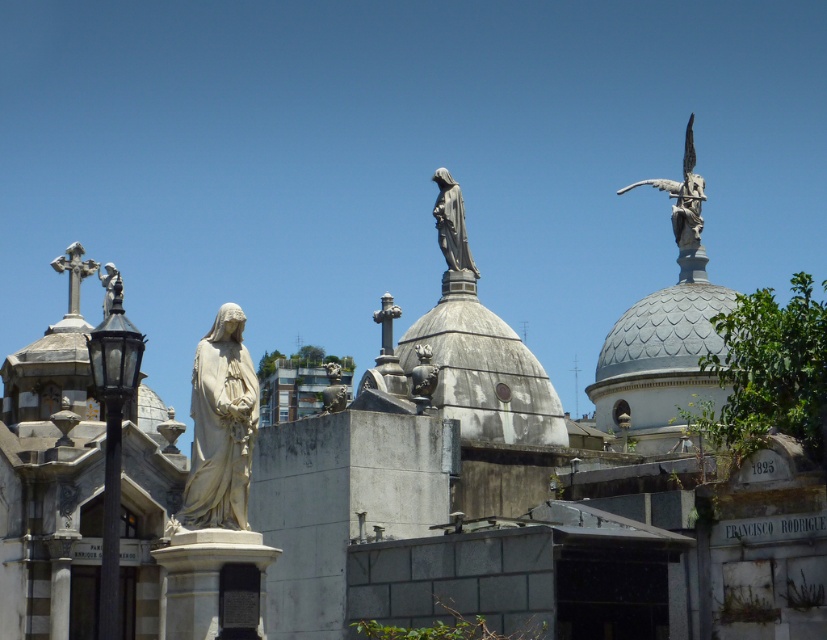
Does polished bronze angel at upper right have a lesser height compared to polished stone cross at upper left?

Incorrect, polished bronze angel at upper right's height does not fall short of polished stone cross at upper left's.

From the picture: Can you confirm if polished bronze angel at upper right is positioned below polished stone cross at upper left?

No, polished bronze angel at upper right is not below polished stone cross at upper left.

This screenshot has width=827, height=640. What are the coordinates of `polished bronze angel at upper right` in the screenshot? It's located at (682, 195).

Is white marble statue at center further to camera compared to polished bronze angel at upper right?

No.

Does point (237, 515) come behind point (657, 179)?

No.

Between point (223, 432) and point (687, 200), which one is positioned behind?

Point (687, 200)

Identify the location of white marble statue at center. (220, 426).

Is polished bronze statue at center smaller than polished bronze angel at upper left?

Correct, polished bronze statue at center occupies less space than polished bronze angel at upper left.

Between polished bronze statue at center and polished bronze angel at upper left, which one has more height?

polished bronze statue at center is taller.

This screenshot has width=827, height=640. Identify the location of polished bronze statue at center. (452, 224).